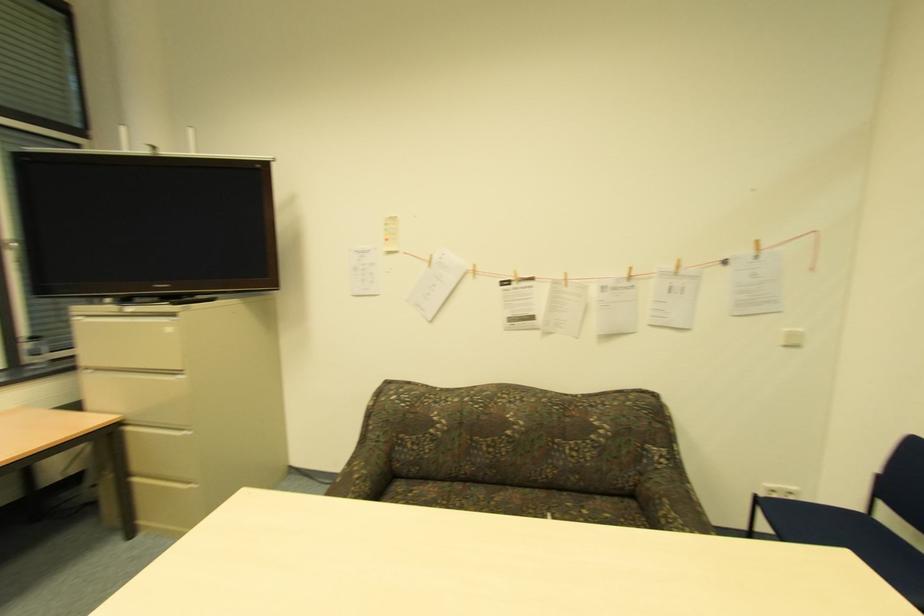
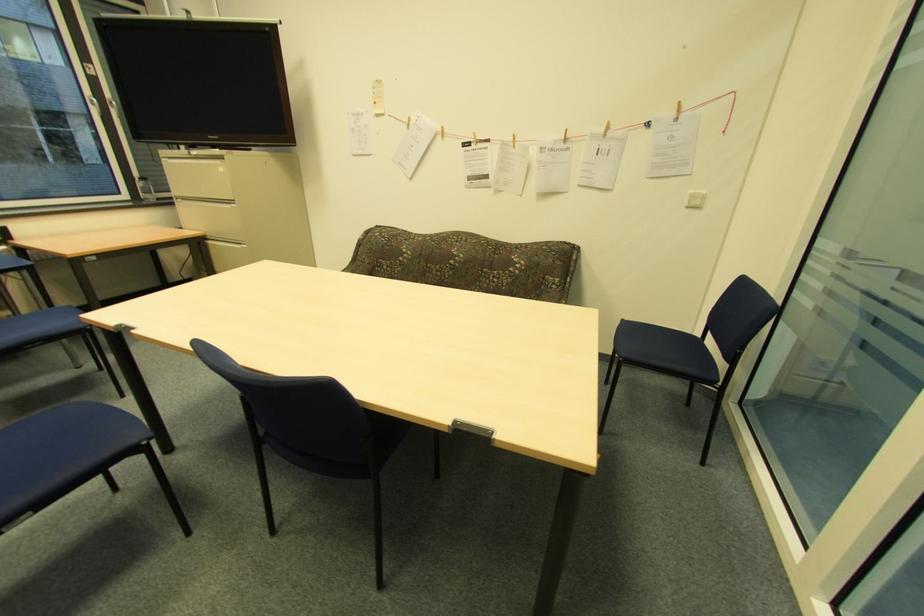
Question: Based on the continuous images, in which direction is the camera rotating? Reply with the corresponding letter.

Choices:
 (A) Left
 (B) Right
 (C) Up
 (D) Down

Answer: (D)